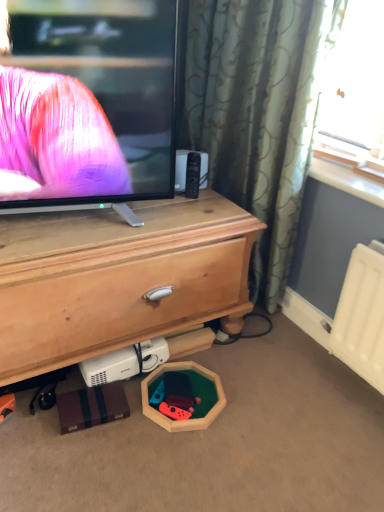
Where is `free space above wooden chest of drawers at center (from a real-world perspective)`? Image resolution: width=384 pixels, height=512 pixels. free space above wooden chest of drawers at center (from a real-world perspective) is located at coordinates (114, 222).